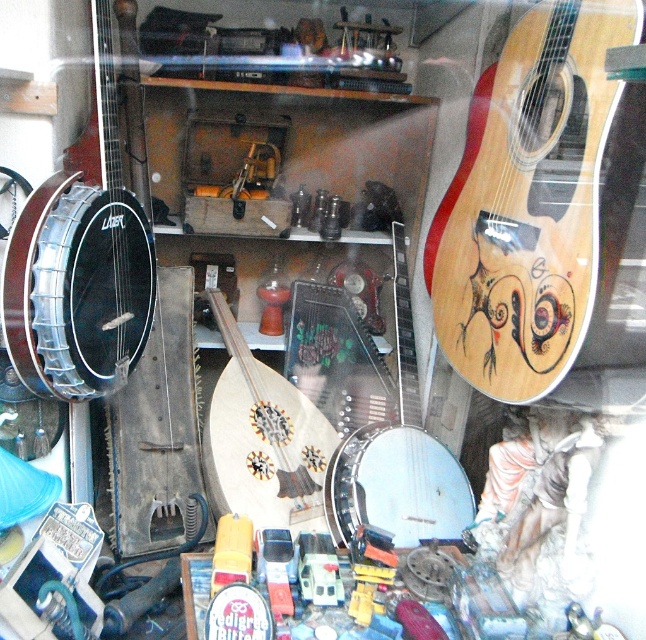
Does wooden acoustic guitar at upper right come behind white matte banjo at center?

No, it is not.

Between wooden acoustic guitar at upper right and white matte banjo at center, which one has more height?

white matte banjo at center

Which is behind, point (450, 348) or point (359, 428)?

The point (359, 428) is behind.

Find the location of a particular element. wooden acoustic guitar at upper right is located at coordinates (536, 198).

Does matte black banjo at left have a lesser width compared to wooden mandolin at center?

Yes, matte black banjo at left is thinner than wooden mandolin at center.

The image size is (646, 640). What do you see at coordinates (79, 264) in the screenshot?
I see `matte black banjo at left` at bounding box center [79, 264].

Find the location of a particular element. matte black banjo at left is located at coordinates (79, 264).

Which is in front, point (599, 22) or point (118, 208)?

Point (599, 22) is in front.

Between wooden acoustic guitar at upper right and matte black banjo at left, which one has less height?

wooden acoustic guitar at upper right is shorter.

Does point (556, 205) lie behind point (112, 340)?

No, (556, 205) is in front of (112, 340).

Image resolution: width=646 pixels, height=640 pixels. I want to click on wooden acoustic guitar at upper right, so click(536, 198).